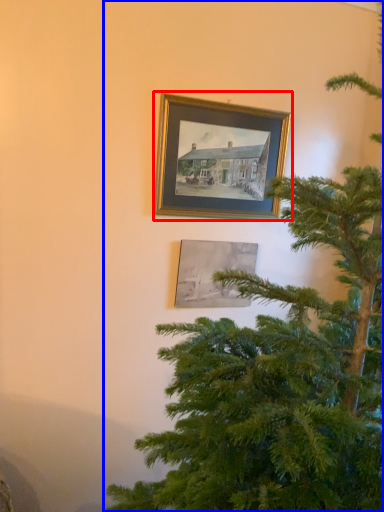
Question: Which object appears closest to the camera in this image, picture frame (highlighted by a red box) or christmas tree (highlighted by a blue box)?

Choices:
 (A) picture frame
 (B) christmas tree

Answer: (B)